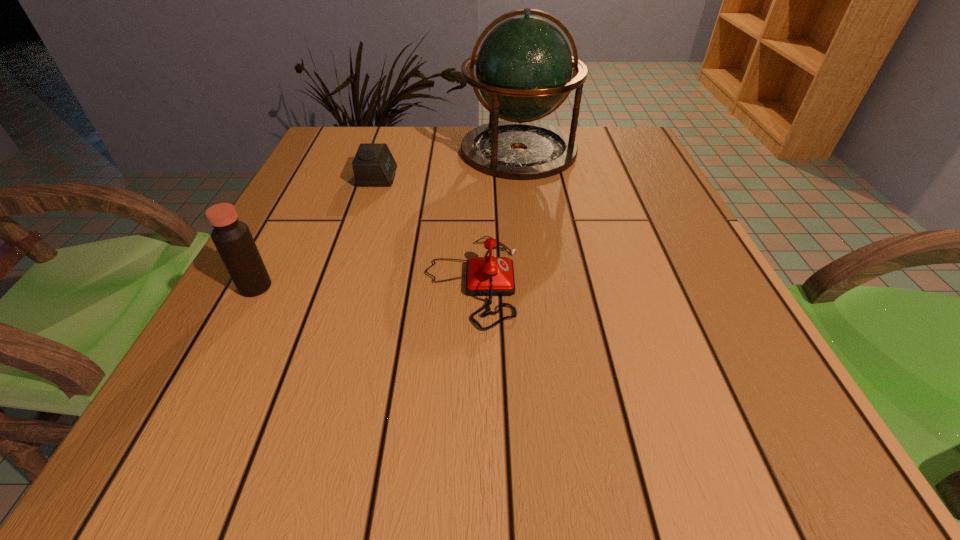
Locate an element on the screen. The width and height of the screenshot is (960, 540). the tallest object is located at coordinates (524, 66).

At what (x,y) coordinates should I click in order to perform the action: click on vinegar. Please return your answer as a coordinate pair (x, y). The width and height of the screenshot is (960, 540). Looking at the image, I should click on (233, 240).

Locate an element on the screen. the leftmost object is located at coordinates tap(233, 240).

Identify the location of the third object from right to left. The image size is (960, 540). (373, 165).

Locate an element on the screen. This screenshot has width=960, height=540. telephone is located at coordinates (490, 276).

Identify the location of vacant space situated on the front-facing side of the globe. This screenshot has height=540, width=960. (526, 205).

I want to click on vacant space situated 0.260m on the front of the leftmost object, so click(x=172, y=445).

In order to click on vacant space situated 0.180m on the front-facing side of the second object from left to right in this screenshot , I will do coord(471,177).

At what (x,y) coordinates should I click in order to perform the action: click on vacant area situated 0.220m on the dial of the telephone. Please return your answer as a coordinate pair (x, y). This screenshot has height=540, width=960. Looking at the image, I should click on (644, 281).

The height and width of the screenshot is (540, 960). I want to click on globe present at the far edge, so click(x=524, y=66).